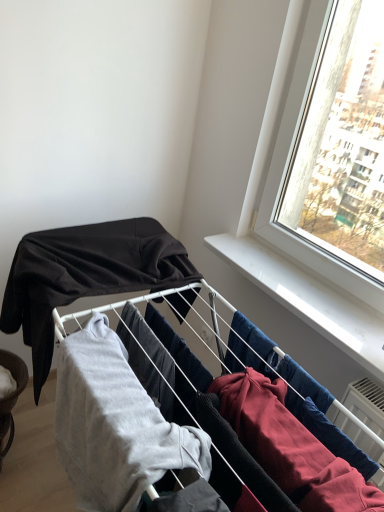
Question: Is matte black fabric at upper left, the 2th clothing viewed from the front, not near light gray cotton sweatshirt at center, the 2th clothing viewed from the back?

Choices:
 (A) no
 (B) yes

Answer: (A)

Question: From the image's perspective, is matte black fabric at upper left, the 2th clothing viewed from the front, on light gray cotton sweatshirt at center, which is the 1th clothing from front to back?

Choices:
 (A) no
 (B) yes

Answer: (B)

Question: Is matte black fabric at upper left, the 2th clothing viewed from the front, positioned beyond the bounds of light gray cotton sweatshirt at center, which is the 1th clothing from front to back?

Choices:
 (A) yes
 (B) no

Answer: (A)

Question: Is matte black fabric at upper left, the 2th clothing viewed from the front, to the left of light gray cotton sweatshirt at center, the 2th clothing viewed from the back, from the viewer's perspective?

Choices:
 (A) no
 (B) yes

Answer: (B)

Question: Is matte black fabric at upper left, acting as the 1th clothing starting from the back, facing towards light gray cotton sweatshirt at center, the 2th clothing viewed from the back?

Choices:
 (A) yes
 (B) no

Answer: (B)

Question: Would you say matte black fabric at upper left, acting as the 1th clothing starting from the back, is inside or outside light gray cotton sweatshirt at center, which is the 1th clothing from front to back?

Choices:
 (A) outside
 (B) inside

Answer: (A)

Question: Considering the positions of matte black fabric at upper left, acting as the 1th clothing starting from the back, and light gray cotton sweatshirt at center, which is the 1th clothing from front to back, in the image, is matte black fabric at upper left, acting as the 1th clothing starting from the back, wider or thinner than light gray cotton sweatshirt at center, which is the 1th clothing from front to back,?

Choices:
 (A) thin
 (B) wide

Answer: (B)

Question: Considering the positions of point (120, 257) and point (104, 338), is point (120, 257) closer or farther from the camera than point (104, 338)?

Choices:
 (A) closer
 (B) farther

Answer: (B)

Question: From a real-world perspective, relative to light gray cotton sweatshirt at center, the 2th clothing viewed from the back, is matte black fabric at upper left, the 2th clothing viewed from the front, vertically above or below?

Choices:
 (A) below
 (B) above

Answer: (B)

Question: In terms of height, does light gray cotton sweatshirt at center, the 2th clothing viewed from the back, look taller or shorter compared to brushed metal bowl at lower left?

Choices:
 (A) short
 (B) tall

Answer: (B)

Question: From the image's perspective, relative to brushed metal bowl at lower left, is light gray cotton sweatshirt at center, the 2th clothing viewed from the back, above or below?

Choices:
 (A) above
 (B) below

Answer: (A)

Question: Considering the relative positions of light gray cotton sweatshirt at center, the 2th clothing viewed from the back, and brushed metal bowl at lower left in the image provided, is light gray cotton sweatshirt at center, the 2th clothing viewed from the back, to the left or to the right of brushed metal bowl at lower left?

Choices:
 (A) right
 (B) left

Answer: (A)

Question: Relative to brushed metal bowl at lower left, is light gray cotton sweatshirt at center, the 2th clothing viewed from the back, in front or behind?

Choices:
 (A) front
 (B) behind

Answer: (A)

Question: Is light gray cotton sweatshirt at center, the 2th clothing viewed from the back, wider or thinner than matte black fabric at upper left, acting as the 1th clothing starting from the back?

Choices:
 (A) wide
 (B) thin

Answer: (B)

Question: Is light gray cotton sweatshirt at center, the 2th clothing viewed from the back, situated inside matte black fabric at upper left, acting as the 1th clothing starting from the back, or outside?

Choices:
 (A) inside
 (B) outside

Answer: (B)